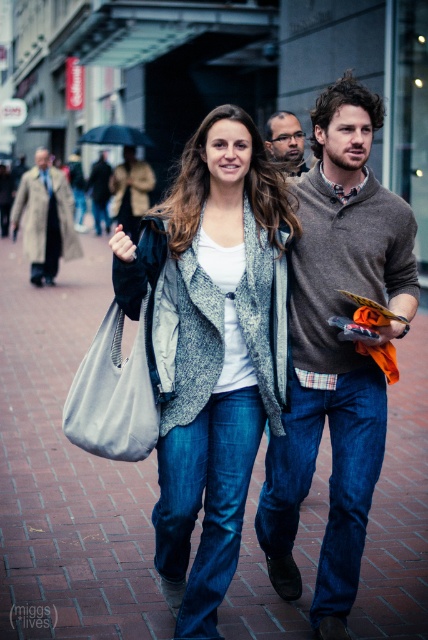
Who is lower down, canvas tote bag at center or matte brown sweater at center?

canvas tote bag at center

Between point (157, 410) and point (279, 134), which one is positioned in front?

Point (157, 410) is in front.

Consider the image. Measure the distance between canvas tote bag at center and camera.

canvas tote bag at center is 3.66 meters away from camera.

Identify the location of canvas tote bag at center. (113, 394).

Can you confirm if knitted gray cardigan at center is thinner than smooth brown hair at center?

In fact, knitted gray cardigan at center might be wider than smooth brown hair at center.

Where is `knitted gray cardigan at center`? The image size is (428, 640). knitted gray cardigan at center is located at coordinates (211, 349).

Is knitted gray cardigan at center behind canvas tote bag at center?

That is False.

Does knitted gray cardigan at center have a lesser width compared to canvas tote bag at center?

No, knitted gray cardigan at center is not thinner than canvas tote bag at center.

Describe the element at coordinates (211, 349) in the screenshot. The image size is (428, 640). I see `knitted gray cardigan at center` at that location.

Locate an element on the screen. Image resolution: width=428 pixels, height=640 pixels. knitted gray cardigan at center is located at coordinates click(x=211, y=349).